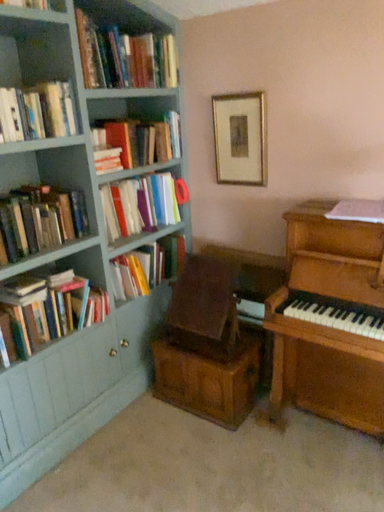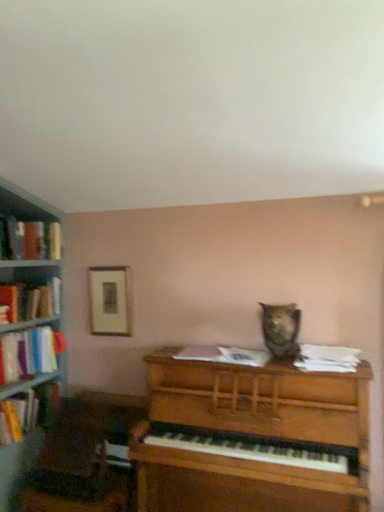
Question: How did the camera likely rotate when shooting the video?

Choices:
 (A) rotated upward
 (B) rotated downward

Answer: (A)